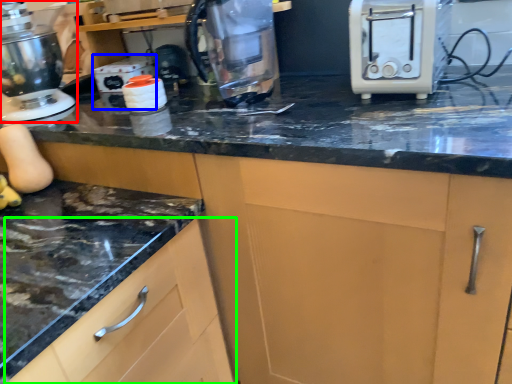
Question: Based on their relative distances, which object is nearer to home appliance (highlighted by a red box)? Choose from appliance (highlighted by a blue box) and cabinetry (highlighted by a green box).

Choices:
 (A) appliance
 (B) cabinetry

Answer: (A)